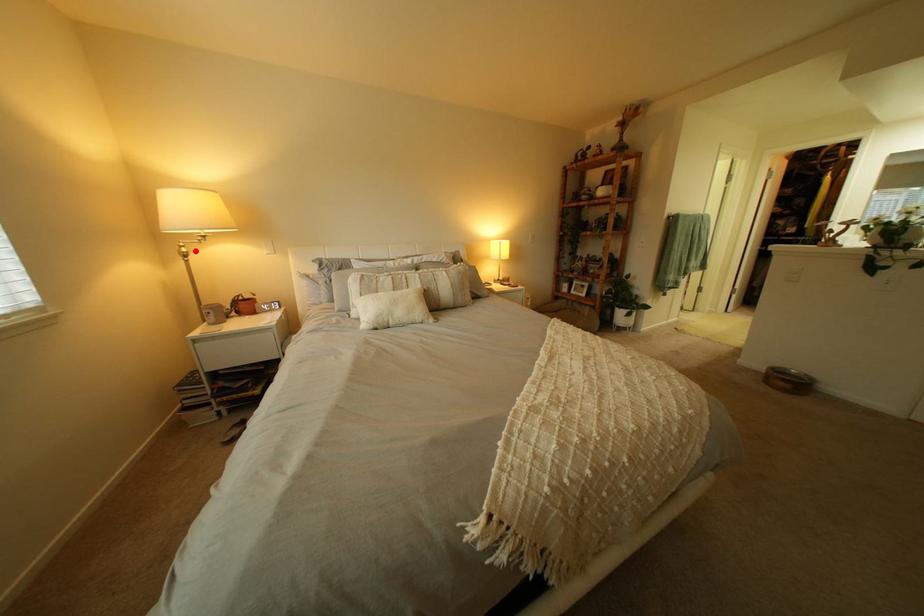
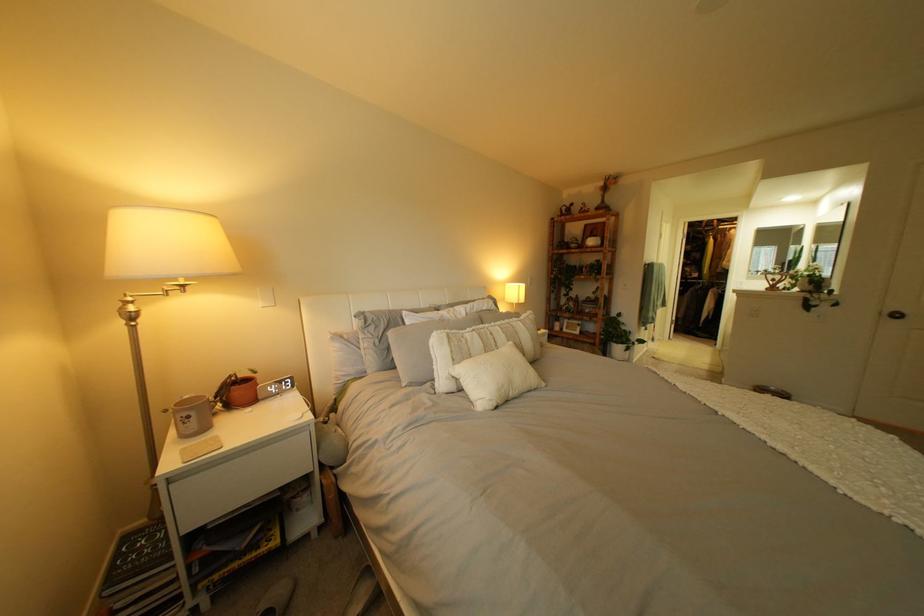
Where in the second image is the point corresponding to the highlighted location from the first image?

(139, 310)